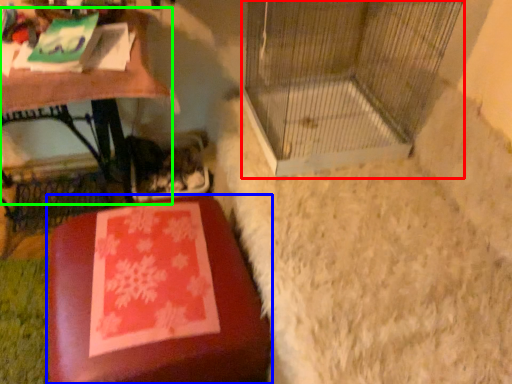
Question: Based on their relative distances, which object is nearer to bird cage (highlighted by a red box)? Choose from furniture (highlighted by a blue box) and table (highlighted by a green box).

Choices:
 (A) furniture
 (B) table

Answer: (B)